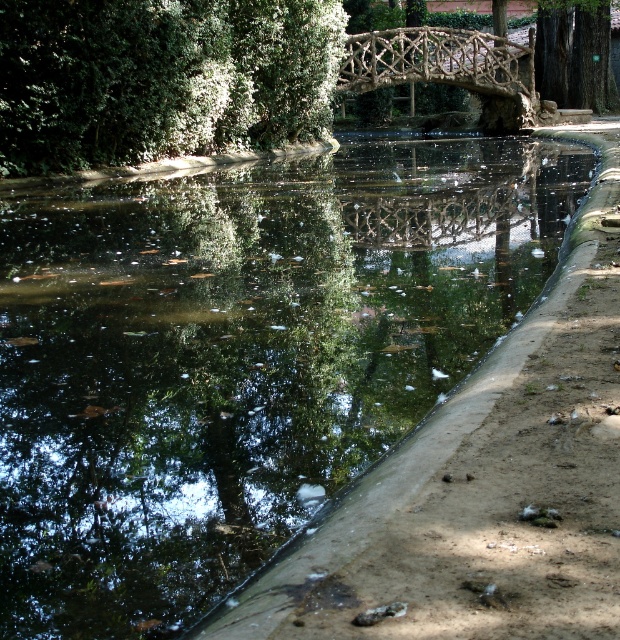
Consider the image. You are an artist planning to paint the scene. You want to ensure the green leafy tree at upper left and the green rough bark tree at upper right are proportionally accurate. Which tree should you paint smaller?

The green leafy tree at upper left should be painted smaller as it has a smaller size compared to the green rough bark tree at upper right.

You are standing at the edge of the canal and want to cross to the other side. The natural wood bridge at center and the green rough bark tree at upper right are visible. Which object is nearer to you, the observer?

The natural wood bridge at center is closer to the viewer than the green rough bark tree at upper right.

You are standing at the point with coordinates point (51, 49) and want to walk towards the point with coordinates point (551, 49). Which direction should you move to reach the other point?

You should move backward because point (51, 49) is in front of point (551, 49).